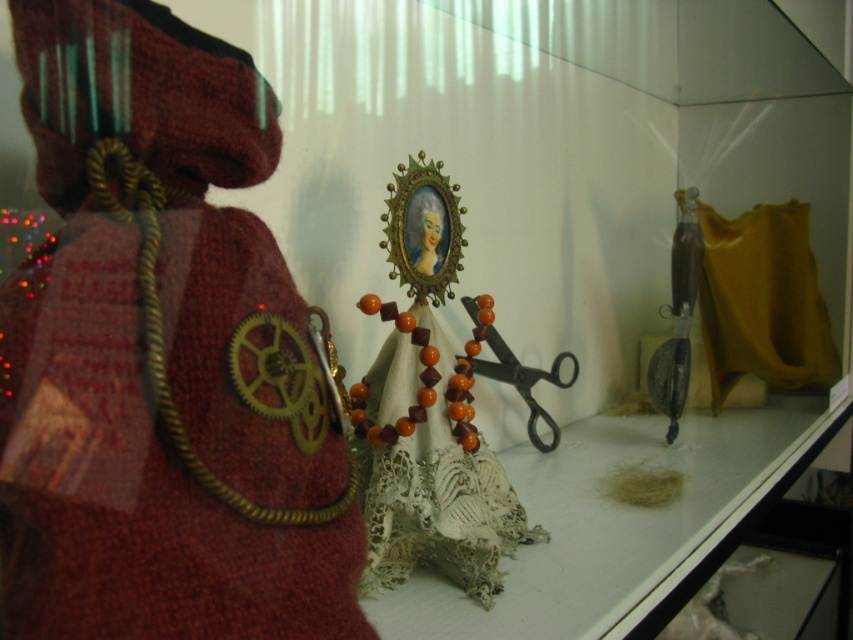
Question: Is orange beaded necklace at center to the right of black metal scissors at center from the viewer's perspective?

Choices:
 (A) no
 (B) yes

Answer: (A)

Question: Which point is closer to the camera?

Choices:
 (A) (469, 307)
 (B) (424, 528)

Answer: (B)

Question: Which point is farther from the camera taking this photo?

Choices:
 (A) (494, 332)
 (B) (393, 516)

Answer: (A)

Question: Does orange beaded necklace at center have a larger size compared to black metal scissors at center?

Choices:
 (A) yes
 (B) no

Answer: (B)

Question: Where is orange beaded necklace at center located in relation to black metal scissors at center in the image?

Choices:
 (A) below
 (B) above

Answer: (A)